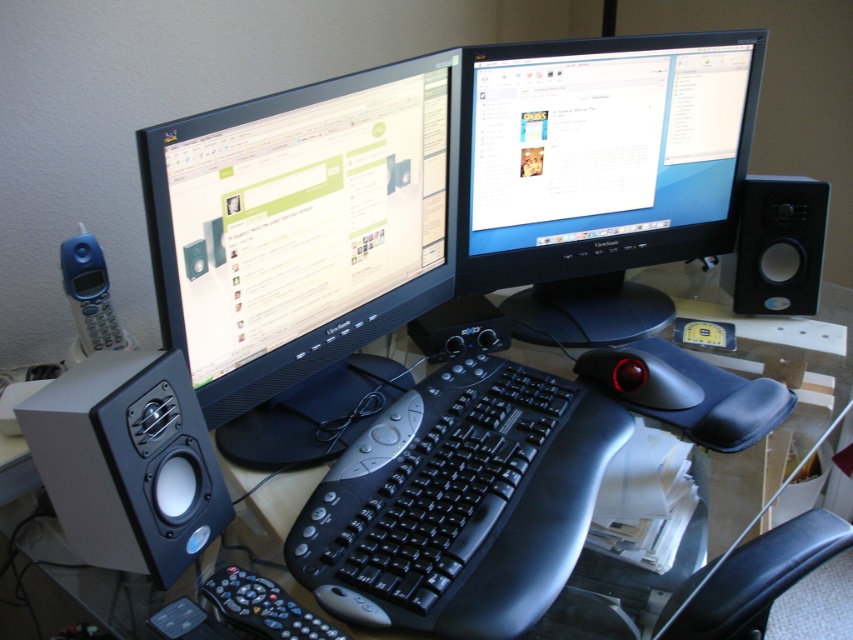
You are setting up a new desk and want to place a 15cm wide object between the two speakers. Based on the image, can you determine if there is enough space between the matte black speaker at left and the black matte speaker at right?

The matte black speaker at left might be wider than the black matte speaker at right, so there might not be enough space between them to fit a 15cm wide object.

You are setting up a new desk and want to place a decorative item between the matte black monitor at center and the black plastic keyboard at center. Given that the decorative item requires 20 cm of space, can you determine if there is enough space between them?

The matte black monitor at center is larger in size than the black plastic keyboard at center, but the exact distance between them isn not specified in the provided information. Therefore, it is uncertain whether there is sufficient space for the decorative item requiring 20 cm.